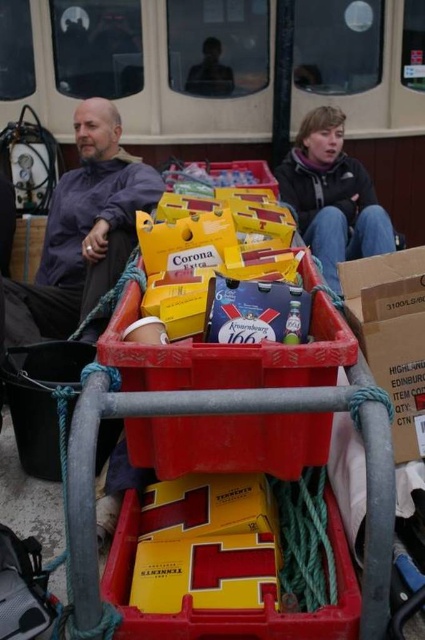
Question: Is cardboard at center to the left of dark gray fleece jacket at upper right from the viewer's perspective?

Choices:
 (A) yes
 (B) no

Answer: (A)

Question: Is cardboard at center to the left of dark gray fleece jacket at upper right from the viewer's perspective?

Choices:
 (A) no
 (B) yes

Answer: (B)

Question: Estimate the real-world distances between objects in this image. Which object is farther from the cardboard at center?

Choices:
 (A) matte purple shirt at left
 (B) dark gray fleece jacket at upper right

Answer: (A)

Question: Which point is farther from the camera taking this photo?

Choices:
 (A) (302, 182)
 (B) (354, 321)
 (C) (74, 129)

Answer: (A)

Question: Considering the relative positions of cardboard at center and dark gray fleece jacket at upper right in the image provided, where is cardboard at center located with respect to dark gray fleece jacket at upper right?

Choices:
 (A) left
 (B) right

Answer: (A)

Question: Considering the real-world distances, which object is closest to the matte purple shirt at left?

Choices:
 (A) dark gray fleece jacket at upper right
 (B) cardboard at center

Answer: (A)